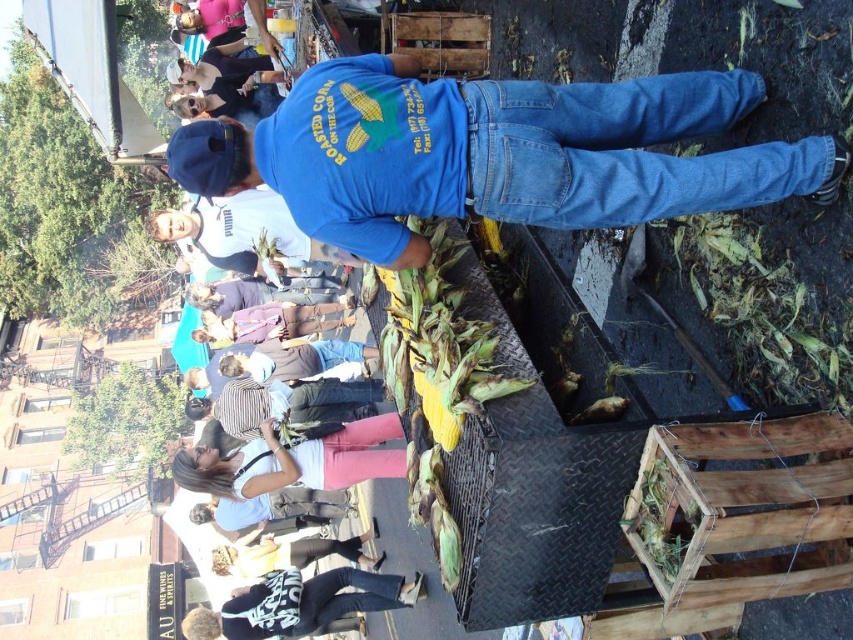
You are a customer at the street market and want to buy roasted corn. You see the denim jacket at lower center and the matte blue shirt at upper center. Which clothing item is closer to the ground?

The denim jacket at lower center is located below the matte blue shirt at upper center, so the denim jacket at lower center is closer to the ground.

You are a customer at the market and want to buy roasted corn. You notice the vendor is wearing two items of clothing. Which clothing item is smaller in size between the blue denim jeans at center and the denim jacket at lower center?

The blue denim jeans at center has a smaller size compared to the denim jacket at lower center, so the blue denim jeans at center is smaller in size.

Where is the blue denim jeans at center located in the image?

The blue denim jeans at center is located at point (494,152) in the image.